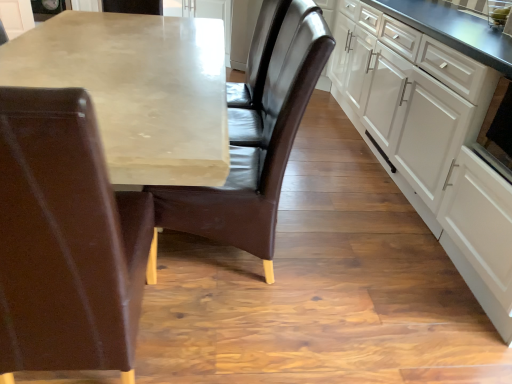
Question: Does white matte cabinet at right have a greater width compared to black glossy oven at right?

Choices:
 (A) no
 (B) yes

Answer: (B)

Question: Is white matte cabinet at right next to black glossy oven at right?

Choices:
 (A) no
 (B) yes

Answer: (A)

Question: Considering the relative sizes of white matte cabinet at right and black glossy oven at right in the image provided, is white matte cabinet at right thinner than black glossy oven at right?

Choices:
 (A) no
 (B) yes

Answer: (A)

Question: Does white matte cabinet at right appear on the left side of black glossy oven at right?

Choices:
 (A) yes
 (B) no

Answer: (B)

Question: From a real-world perspective, is white matte cabinet at right on black glossy oven at right?

Choices:
 (A) no
 (B) yes

Answer: (A)

Question: Is white matte cabinet at right positioned beyond the bounds of black glossy oven at right?

Choices:
 (A) yes
 (B) no

Answer: (A)

Question: Is white matte cabinet at right further to camera compared to matte concrete table at center?

Choices:
 (A) no
 (B) yes

Answer: (B)

Question: Can you confirm if white matte cabinet at right is shorter than matte concrete table at center?

Choices:
 (A) yes
 (B) no

Answer: (B)

Question: Is white matte cabinet at right positioned in front of matte concrete table at center?

Choices:
 (A) no
 (B) yes

Answer: (A)

Question: Is white matte cabinet at right with matte concrete table at center?

Choices:
 (A) yes
 (B) no

Answer: (B)

Question: Is white matte cabinet at right to the right of matte concrete table at center from the viewer's perspective?

Choices:
 (A) yes
 (B) no

Answer: (A)

Question: From a real-world perspective, is white matte cabinet at right on matte concrete table at center?

Choices:
 (A) no
 (B) yes

Answer: (B)

Question: Considering the relative sizes of matte concrete table at center and leather chair at left, which is the first chair from left to right, in the image provided, is matte concrete table at center bigger than leather chair at left, which is the first chair from left to right,?

Choices:
 (A) yes
 (B) no

Answer: (A)